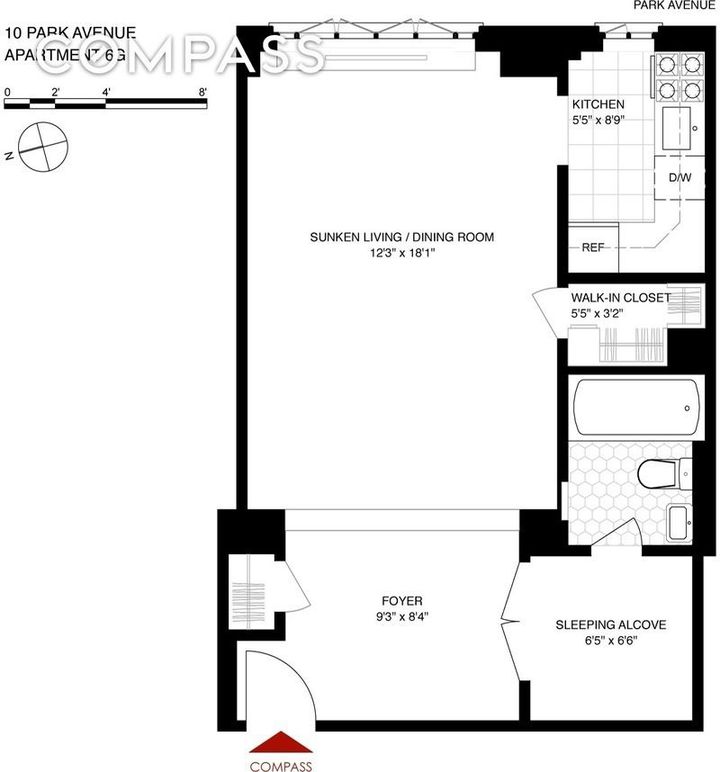
I want to click on "sleeping alcove" written in black capital letters, so click(x=572, y=621), click(x=639, y=625).